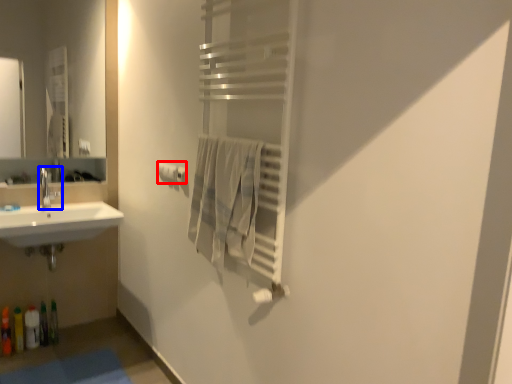
Question: Among these objects, which one is farthest to the camera, toilet paper (highlighted by a red box) or tap (highlighted by a blue box)?

Choices:
 (A) toilet paper
 (B) tap

Answer: (B)